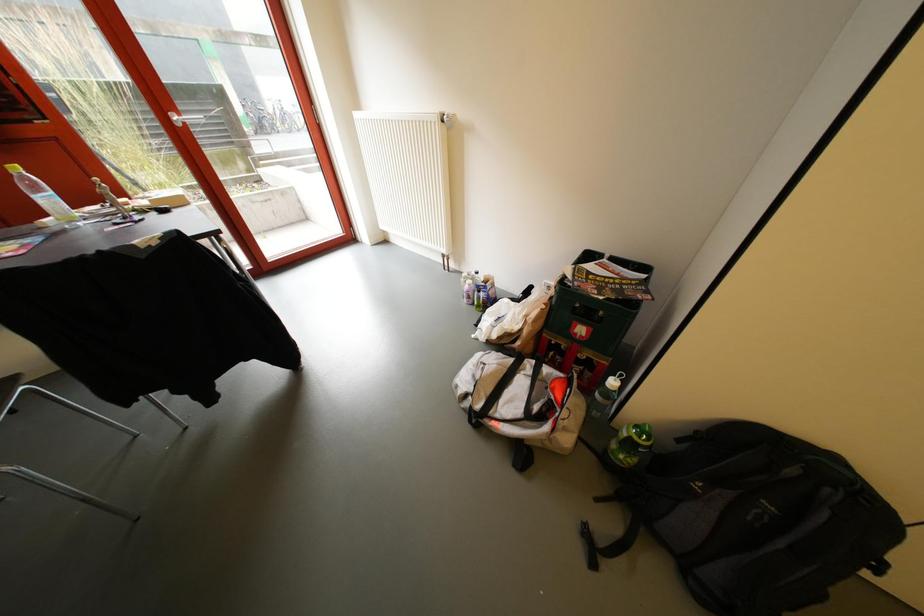
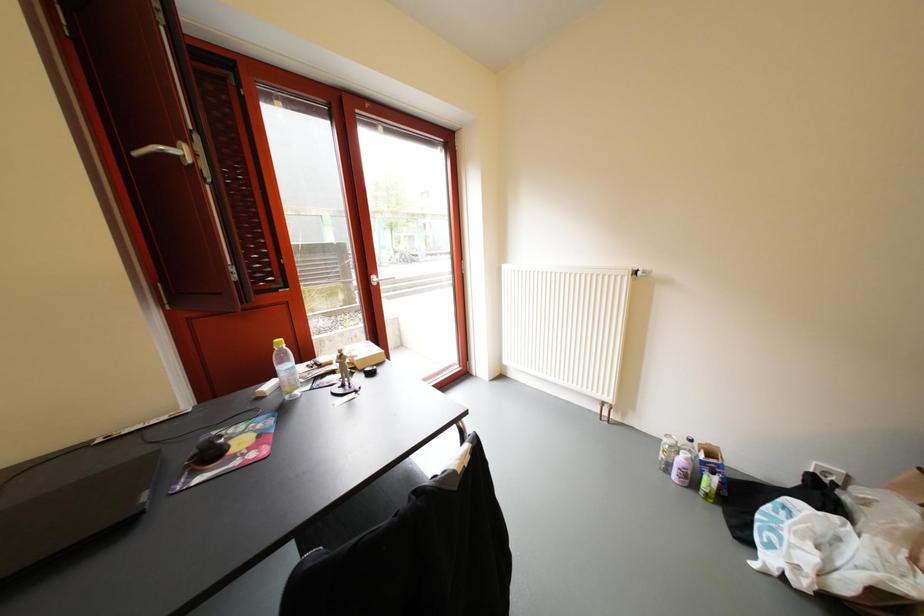
Question: Based on the continuous images, in which direction is the camera rotating? Reply with the corresponding letter.

Choices:
 (A) Left
 (B) Right
 (C) Up
 (D) Down

Answer: (C)